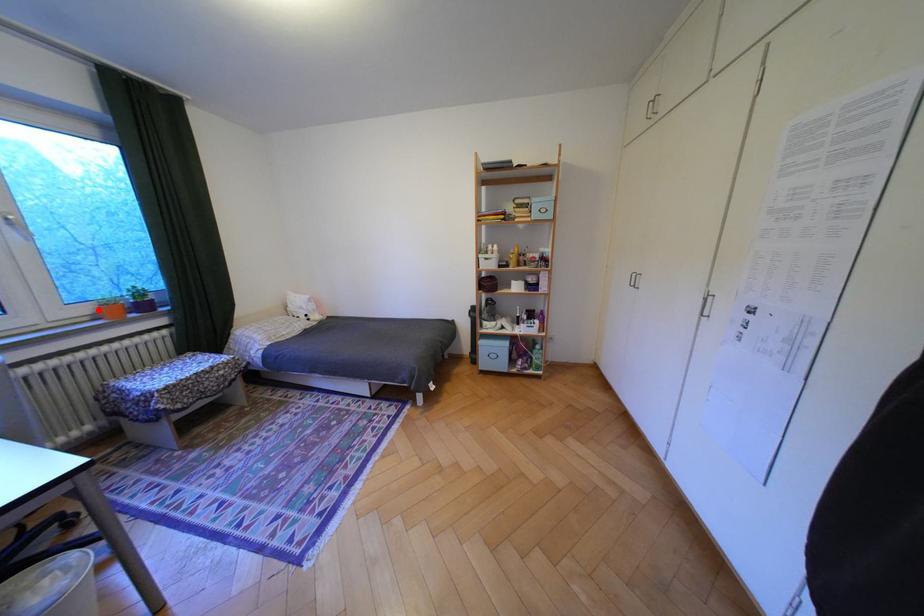
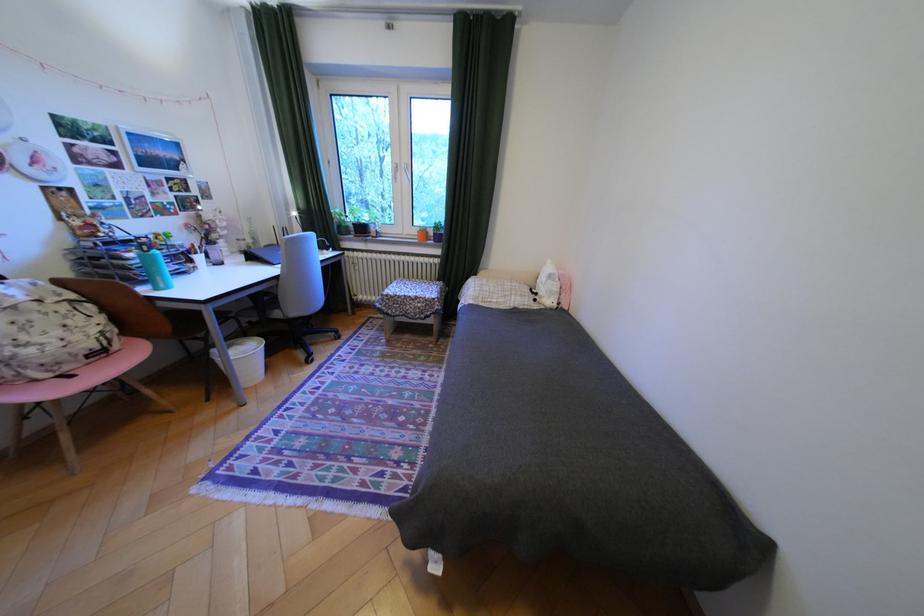
Question: I am providing you with two images of the same scene from different viewpoints. Given a red point in image1, look at the same physical point in image2. Is it:

Choices:
 (A) Closer to the viewpoint
 (B) Farther from the viewpoint

Answer: (A)